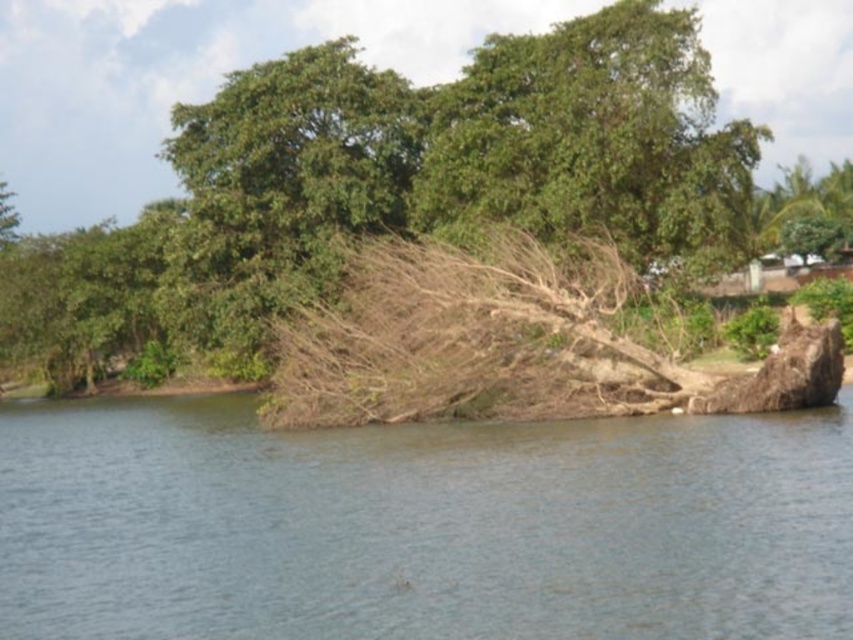
In the scene shown: You are a hiker who wants to cross the river using the fallen tree. However, you notice the brown dirt at center and the green leafy tree at upper right. Which object is positioned lower in the scene?

The brown dirt at center is located below the green leafy tree at upper right, so the brown dirt at center is positioned lower in the scene.

You are a hiker trying to cross the water using the fallen tree. The brown dirt at center is the starting point. Which object will you encounter first as you move towards the green leafy tree at upper center?

You will first encounter the brown dirt at center before reaching the green leafy tree at upper center because the brown dirt at center is smaller in size compared to the green leafy tree at upper center, indicating it is closer to your starting position.